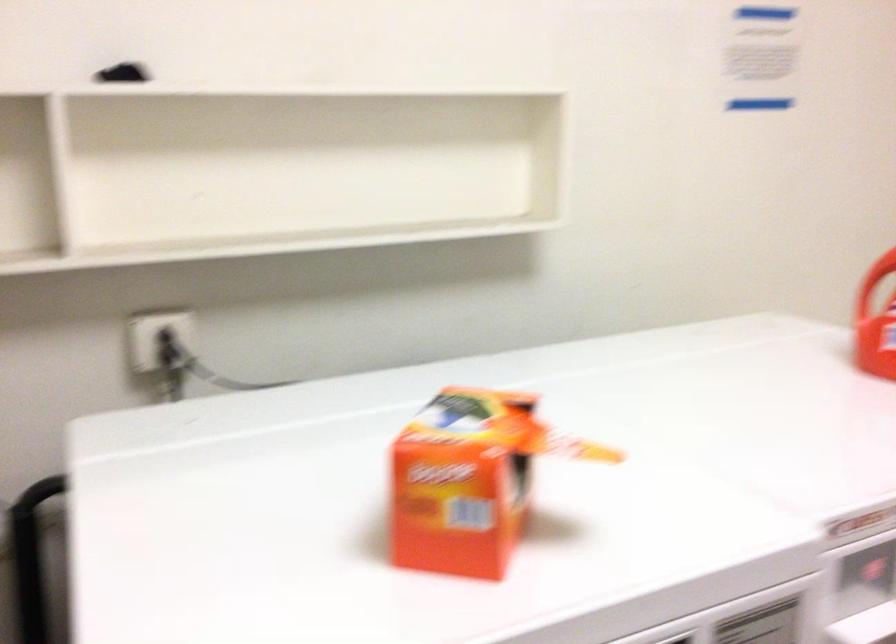
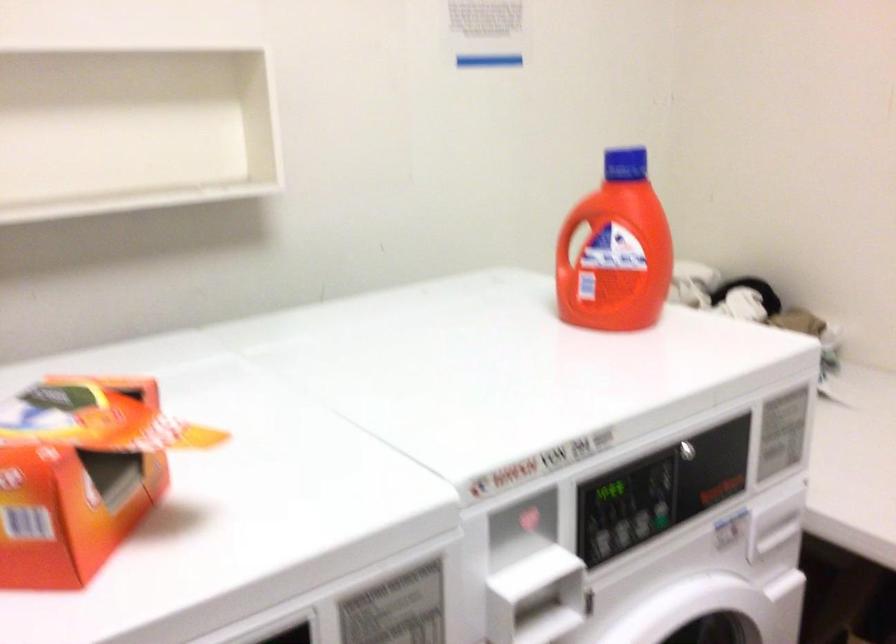
Question: I am providing you with two images of the same scene from different viewpoints. Which of the following objects are not visible in image2?

Choices:
 (A) blue bottle cap
 (B) detergent bottle handle
 (C) washing machine handle
 (D) none of these

Answer: (D)